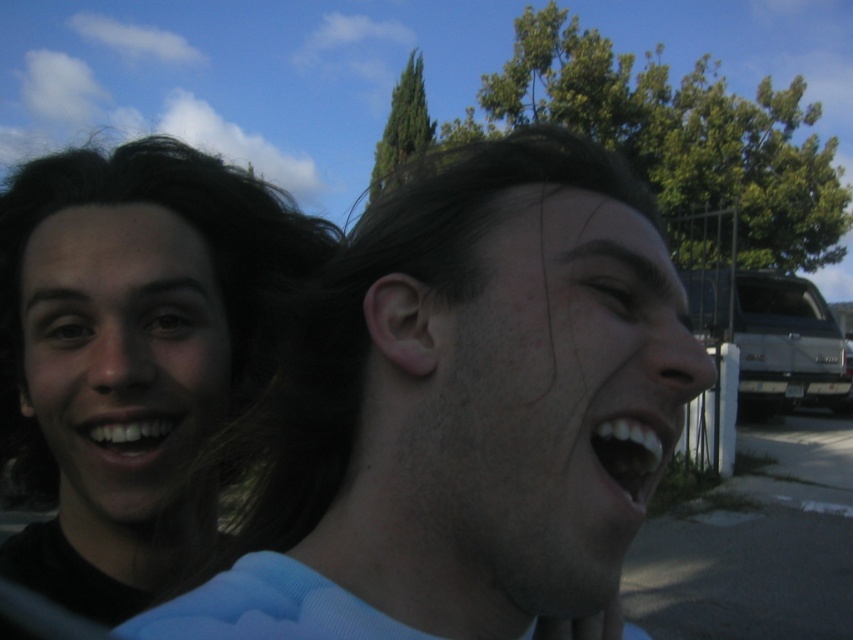
Is smooth skin face at center positioned behind silver metallic truck at right?

No, smooth skin face at center is closer to the viewer.

Which of these two, smooth skin face at center or silver metallic truck at right, stands taller?

Standing taller between the two is silver metallic truck at right.

Describe the element at coordinates (556, 397) in the screenshot. Image resolution: width=853 pixels, height=640 pixels. I see `smooth skin face at center` at that location.

I want to click on smooth skin face at center, so click(x=556, y=397).

Does smooth skin face at center have a lesser width compared to matte black face at left?

Incorrect, smooth skin face at center's width is not less than matte black face at left's.

The image size is (853, 640). What do you see at coordinates (556, 397) in the screenshot?
I see `smooth skin face at center` at bounding box center [556, 397].

Does point (582, 358) lie in front of point (136, 243)?

Yes, point (582, 358) is closer to viewer.

You are a GUI agent. You are given a task and a screenshot of the screen. Output one action in this format:
    pyautogui.click(x=<x>, y=<y>)
    Task: Click on the smooth skin face at center
    The height and width of the screenshot is (640, 853).
    Given the screenshot: What is the action you would take?
    pyautogui.click(x=556, y=397)

Is matte black face at left to the left of white glossy teeth at lower right from the viewer's perspective?

Indeed, matte black face at left is positioned on the left side of white glossy teeth at lower right.

Can you confirm if matte black face at left is taller than white glossy teeth at lower right?

Yes.

Does point (74, 452) lie in front of point (627, 444)?

That is False.

Find the location of a particular element. matte black face at left is located at coordinates (120, 353).